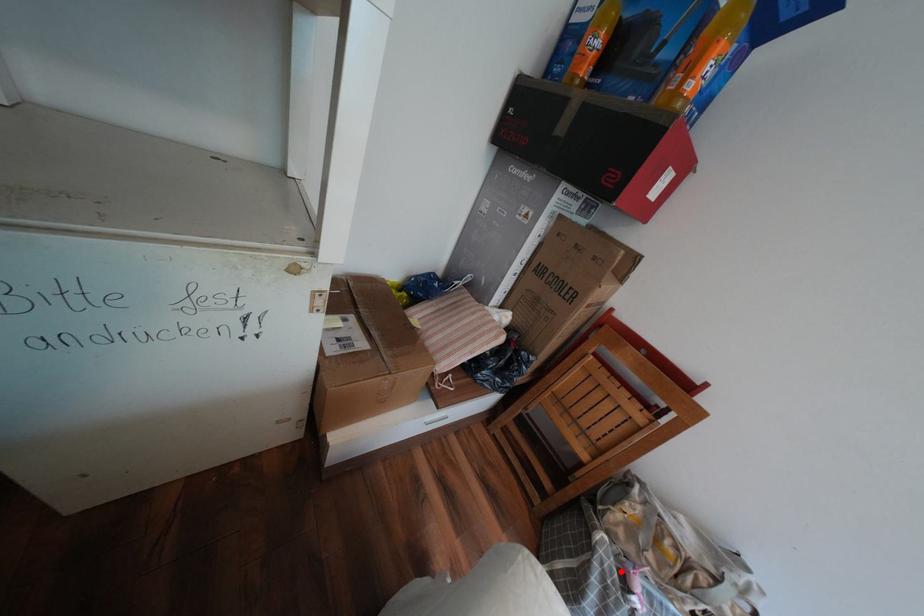
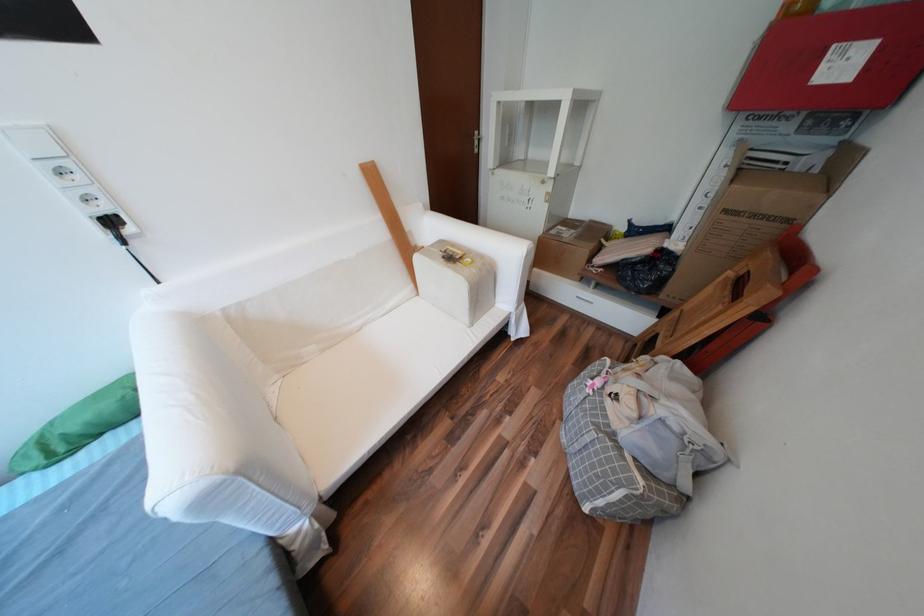
Question: I am providing you with two images of the same scene from different viewpoints. A red point is shown in image1. For the corresponding object point in image2, is it positioned nearer or farther from the camera?

Choices:
 (A) Nearer
 (B) Farther

Answer: (A)